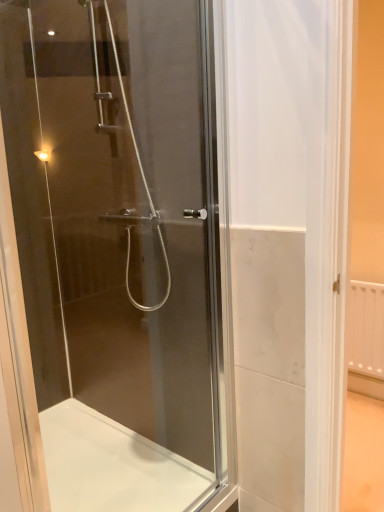
Question: Considering the positions of point (205, 2) and point (112, 492), is point (205, 2) closer or farther from the camera than point (112, 492)?

Choices:
 (A) farther
 (B) closer

Answer: (B)

Question: Is transparent glass shower door at center in front of or behind white glossy bath at lower center in the image?

Choices:
 (A) behind
 (B) front

Answer: (B)

Question: In terms of size, does transparent glass shower door at center appear bigger or smaller than white glossy bath at lower center?

Choices:
 (A) small
 (B) big

Answer: (A)

Question: Is white glossy bath at lower center inside or outside of transparent glass shower door at center?

Choices:
 (A) outside
 (B) inside

Answer: (A)

Question: Does point (173, 464) appear closer or farther from the camera than point (16, 39)?

Choices:
 (A) farther
 (B) closer

Answer: (B)

Question: Would you say white glossy bath at lower center is to the left or to the right of transparent glass shower door at center in the picture?

Choices:
 (A) right
 (B) left

Answer: (B)

Question: In the image, is white glossy bath at lower center positioned in front of or behind transparent glass shower door at center?

Choices:
 (A) front
 (B) behind

Answer: (B)